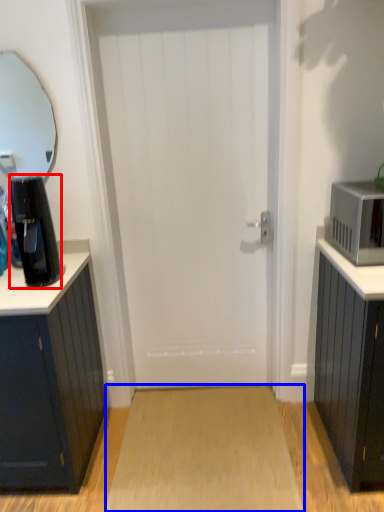
Question: Which object is closer to the camera taking this photo, coffee maker (highlighted by a red box) or plain (highlighted by a blue box)?

Choices:
 (A) coffee maker
 (B) plain

Answer: (A)